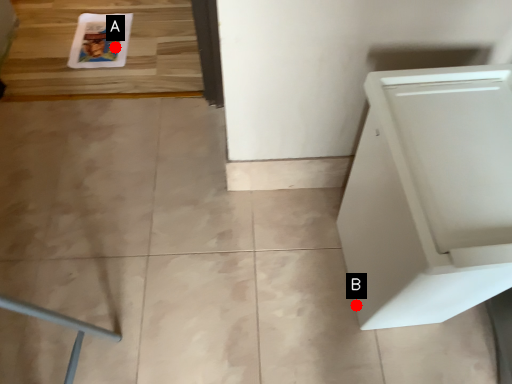
Question: Two points are circled on the image, labeled by A and B beside each circle. Which point is closer to the camera taking this photo?

Choices:
 (A) A is closer
 (B) B is closer

Answer: (B)